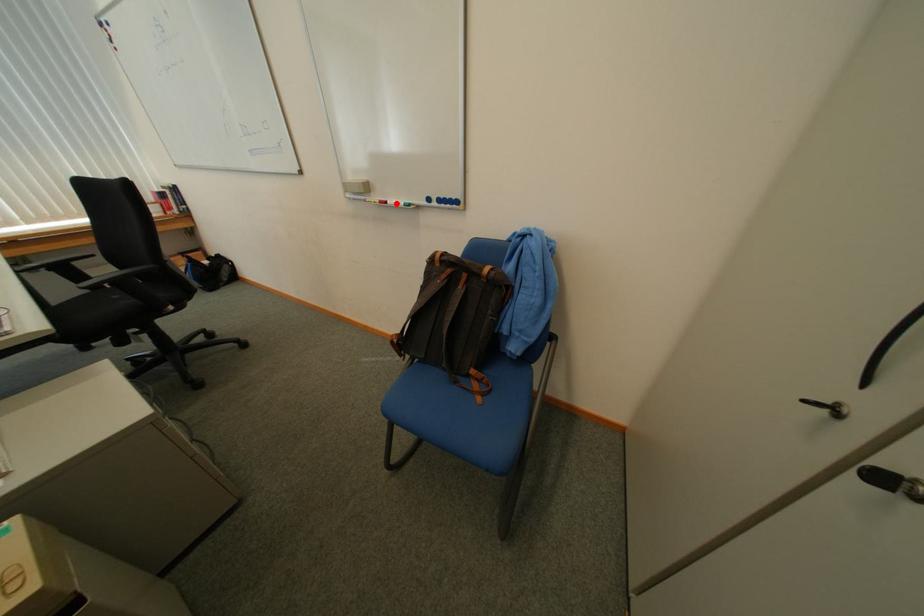
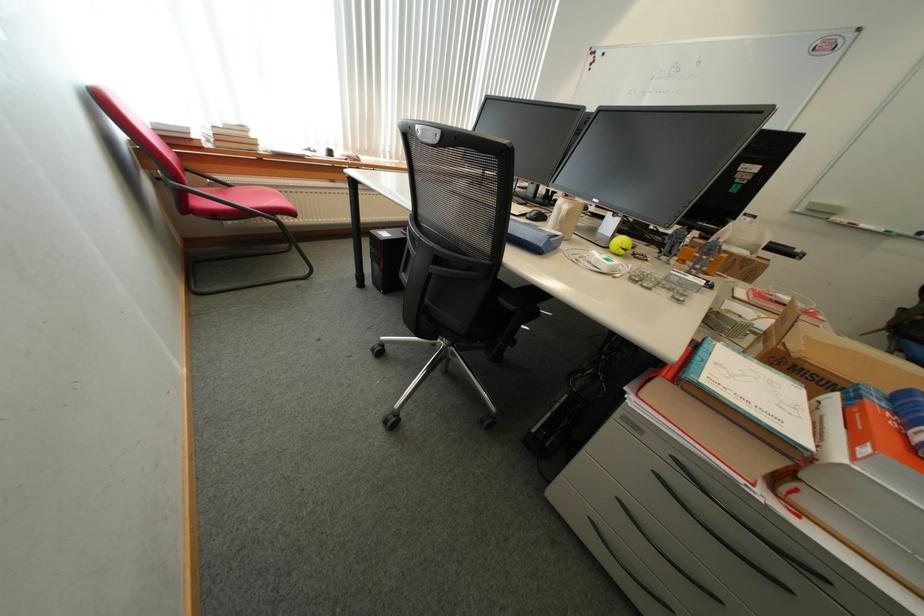
Question: I am providing you with two images of the same scene from different viewpoints. In image1, a red point is highlighted. Considering the same 3D point in image2, which of the following is correct?

Choices:
 (A) It is closer
 (B) It is farther

Answer: (B)